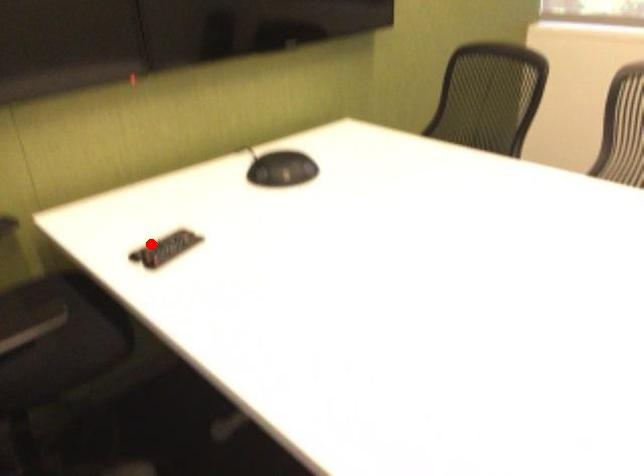
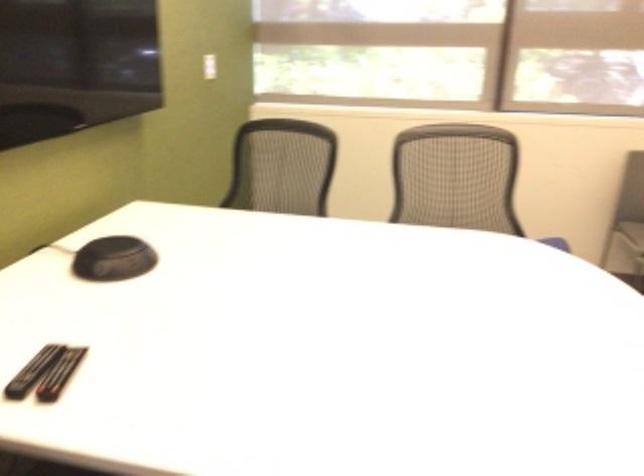
Question: I am providing you with two images of the same scene from different viewpoints. A red point is marked on the first image. Can you still see the location of the red point in image 2?

Choices:
 (A) Yes
 (B) No

Answer: (A)